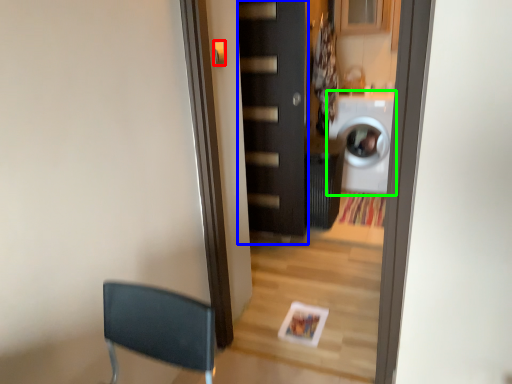
Question: Estimate the real-world distances between objects in this image. Which object is farther from door handle (highlighted by a red box), door (highlighted by a blue box) or washing machine (highlighted by a green box)?

Choices:
 (A) door
 (B) washing machine

Answer: (B)